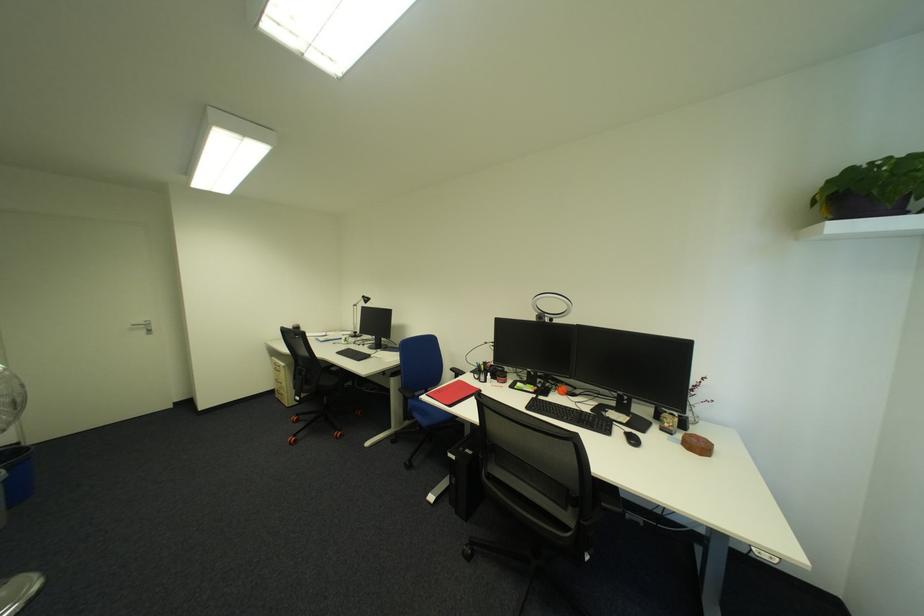
The location [550,306] corresponds to which object?

This point indicates the ring light.